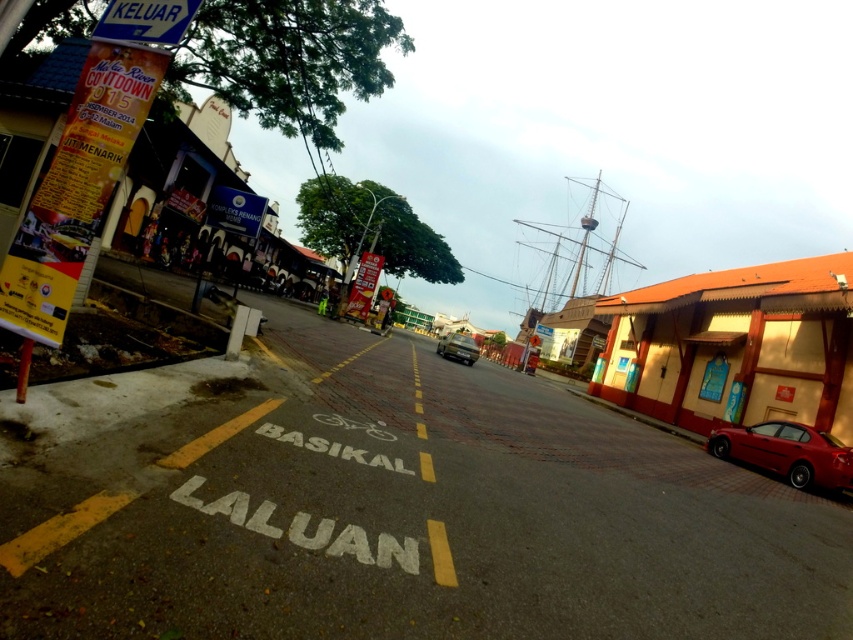
From the picture: Between shiny red car at lower right and metallic silver car at center, which one is positioned higher?

Positioned higher is metallic silver car at center.

Is shiny red car at lower right further to camera compared to metallic silver car at center?

That is False.

Does point (851, 448) come closer to viewer compared to point (450, 333)?

Yes, it is in front of point (450, 333).

I want to click on shiny red car at lower right, so click(787, 452).